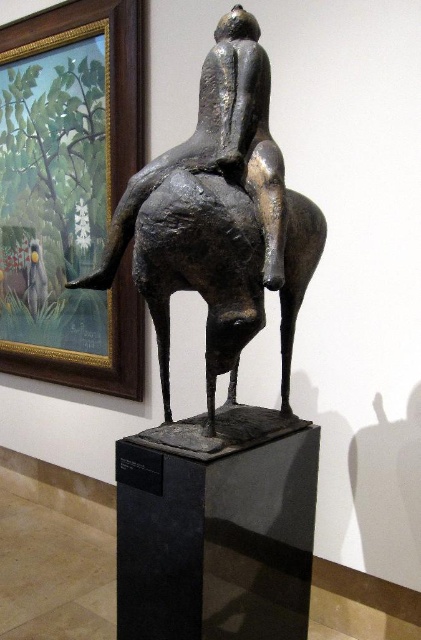
Does gold-framed painting at upper left have a smaller size compared to bronze statue at center?

Actually, gold-framed painting at upper left might be larger than bronze statue at center.

Consider the image. Can you confirm if gold-framed painting at upper left is shorter than bronze statue at center?

Incorrect, gold-framed painting at upper left's height does not fall short of bronze statue at center's.

Is point (12, 328) less distant than point (212, 330)?

No, (12, 328) is behind (212, 330).

Locate an element on the screen. Image resolution: width=421 pixels, height=640 pixels. gold-framed painting at upper left is located at coordinates (69, 193).